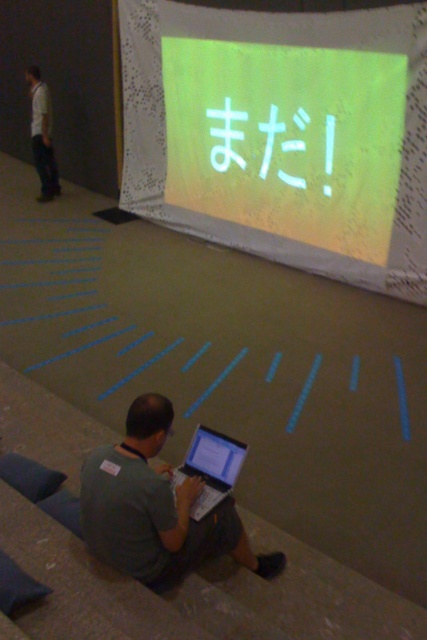
You are a technician checking two laptops in the image. The green matte laptop at lower center and the matte black laptop at center. Which one is taller?

The green matte laptop at lower center has a greater height compared to the matte black laptop at center, so it is taller.

You are a photographer trying to capture a clear shot of the person on the staircase. The matte yellow fabric at upper center and the light gray shirt at left are both in your viewfinder. Which object is closer to the camera, and why?

The matte yellow fabric at upper center is closer to the camera because it is positioned in front of the light gray shirt at left.

You are standing at the point labeled point [34,125] and want to move to the point labeled point [392,225]. Which direction should you move to get closer to the camera?

To move closer to the camera, you should move towards point [392,225] because it is closer to the camera than point [34,125].